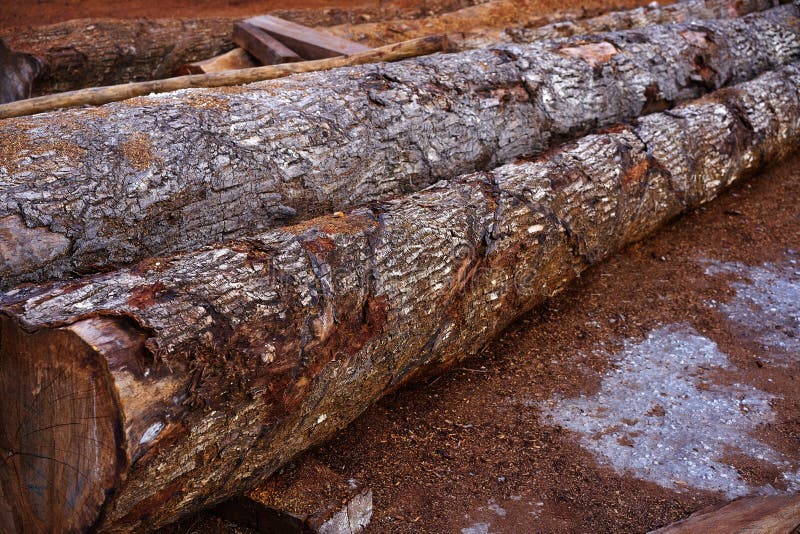
At what (x,y) coordinates should I click in order to perform the action: click on beams. Please return your answer as a coordinate pair (x, y). Looking at the image, I should click on (320, 500), (322, 31), (285, 44).